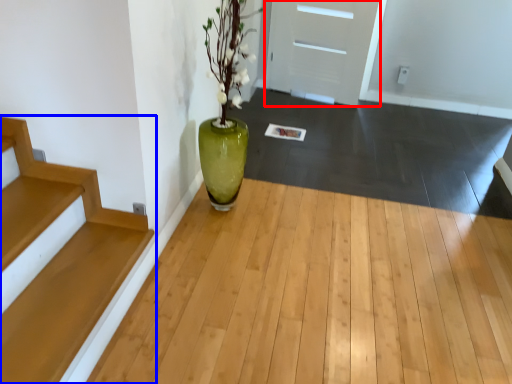
Question: Which of the following is the closest to the observer, door (highlighted by a red box) or stairs (highlighted by a blue box)?

Choices:
 (A) door
 (B) stairs

Answer: (B)